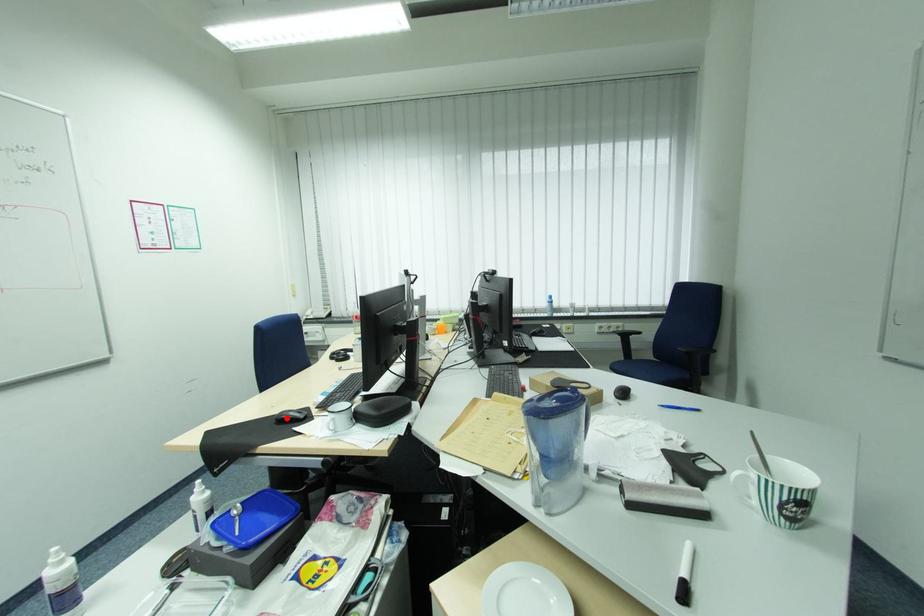
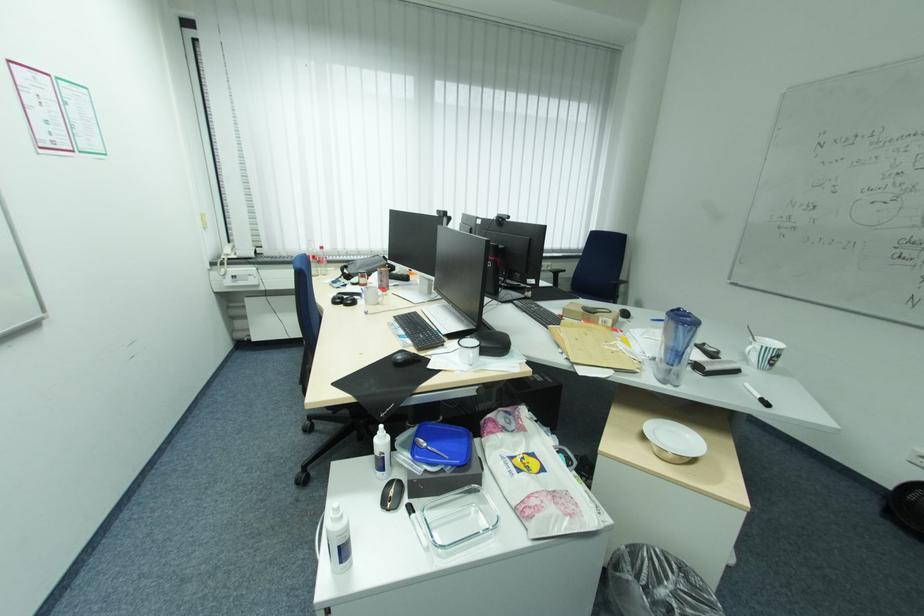
In the second image, find the point that corresponds to the highlighted location in the first image.

(406, 361)